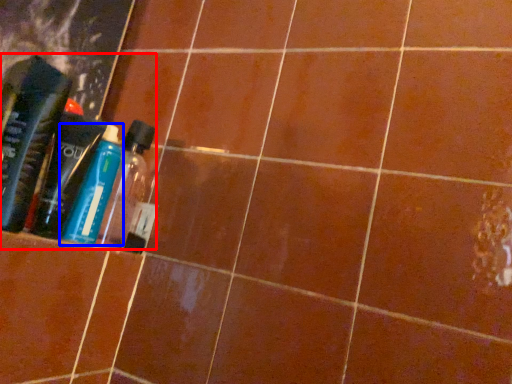
Question: Which point is further to the camera, product (highlighted by a red box) or bottle (highlighted by a blue box)?

Choices:
 (A) product
 (B) bottle

Answer: (A)